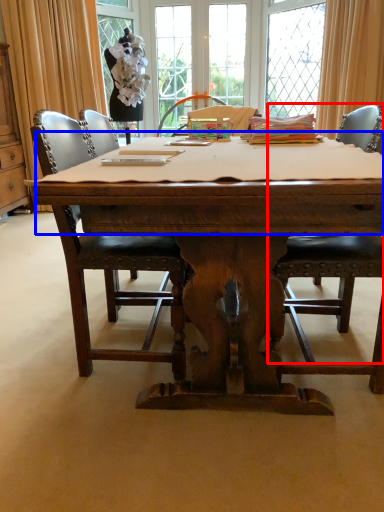
Question: Among these objects, which one is nearest to the camera, chair (highlighted by a red box) or tablecloth (highlighted by a blue box)?

Choices:
 (A) chair
 (B) tablecloth

Answer: (B)